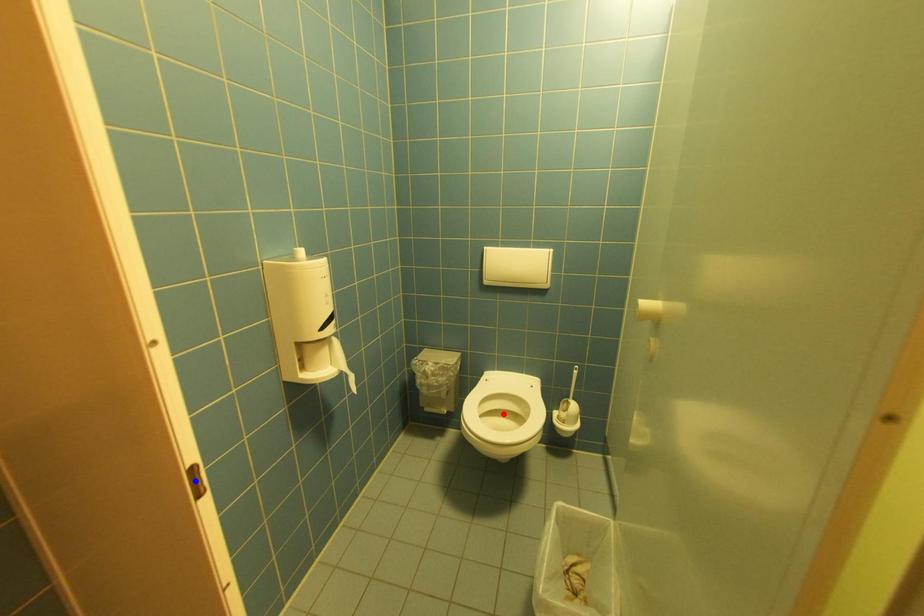
Question: Which of the two points in the image is closer to the camera?

Choices:
 (A) Blue point is closer.
 (B) Red point is closer.

Answer: (A)